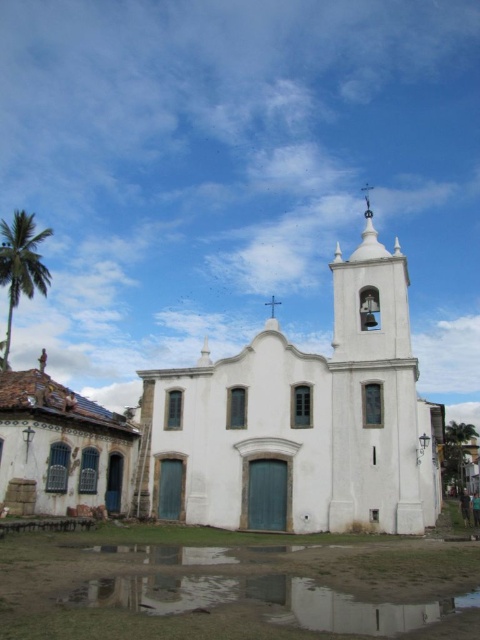
Is rustic clay roof tiles at lower left closer to the viewer compared to green leafy palm tree at left?

Yes, rustic clay roof tiles at lower left is closer to the viewer.

Can you confirm if rustic clay roof tiles at lower left is wider than green leafy palm tree at left?

Indeed, rustic clay roof tiles at lower left has a greater width compared to green leafy palm tree at left.

Is point (37, 413) positioned after point (46, 230)?

No, (37, 413) is in front of (46, 230).

Identify the location of rustic clay roof tiles at lower left. The image size is (480, 640). (62, 444).

What do you see at coordinates (300, 420) in the screenshot? The image size is (480, 640). I see `white stucco chapel at center` at bounding box center [300, 420].

Who is shorter, white stucco chapel at center or rustic clay roof tiles at lower left?

Standing shorter between the two is rustic clay roof tiles at lower left.

What are the coordinates of `white stucco chapel at center` in the screenshot? It's located at (300, 420).

Is white stucco chapel at center taller than green leafy palm tree at left?

Indeed, white stucco chapel at center has a greater height compared to green leafy palm tree at left.

Which is in front, point (391, 486) or point (10, 244)?

Point (391, 486)

Find the location of a particular element. This screenshot has height=640, width=480. white stucco chapel at center is located at coordinates (300, 420).